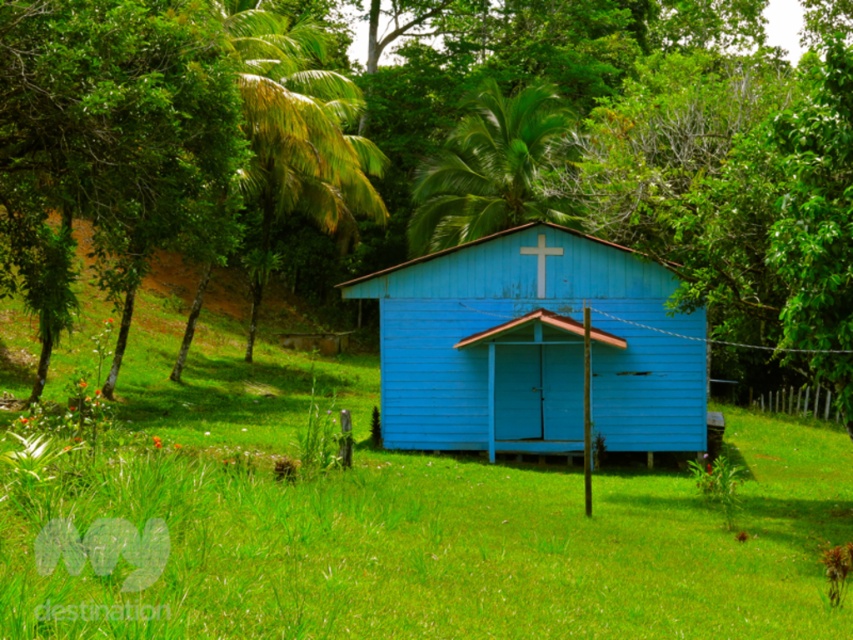
Is blue wooden hut at center above green leafy tree at left?

Incorrect, blue wooden hut at center is not positioned above green leafy tree at left.

The height and width of the screenshot is (640, 853). What do you see at coordinates (532, 348) in the screenshot?
I see `blue wooden hut at center` at bounding box center [532, 348].

Which is in front, point (413, 422) or point (187, 97)?

Positioned in front is point (187, 97).

Locate an element on the screen. blue wooden hut at center is located at coordinates (532, 348).

Does blue wooden hut at center appear over green leafy palm tree at upper center?

No.

Can you confirm if blue wooden hut at center is shorter than green leafy palm tree at upper center?

No, blue wooden hut at center is not shorter than green leafy palm tree at upper center.

Which is in front, point (616, 260) or point (563, 129)?

Point (616, 260) is in front.

This screenshot has height=640, width=853. In order to click on blue wooden hut at center in this screenshot , I will do `click(532, 348)`.

Does point (86, 52) come closer to viewer compared to point (519, 209)?

That is True.

You are a GUI agent. You are given a task and a screenshot of the screen. Output one action in this format:
    pyautogui.click(x=<x>, y=<y>)
    Task: Click on the green leafy tree at left
    This screenshot has height=640, width=853.
    Given the screenshot: What is the action you would take?
    pyautogui.click(x=105, y=141)

Measure the distance between green leafy tree at left and camera.

A distance of 13.06 meters exists between green leafy tree at left and camera.

Where is `green leafy tree at left`? green leafy tree at left is located at coordinates (105, 141).